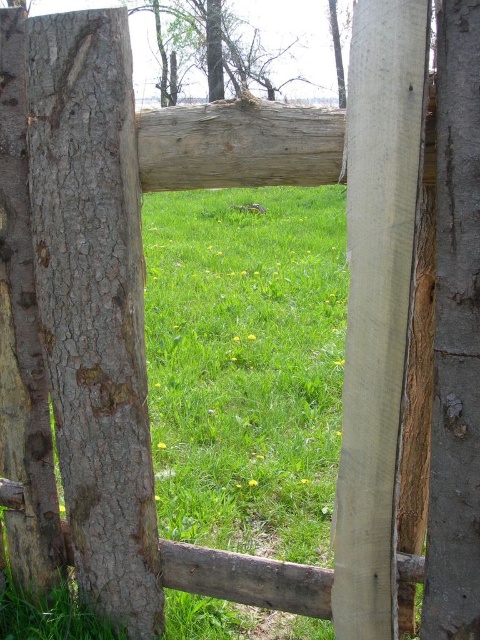
You are a painter setting up your easel to capture the rustic wooden fence and the surrounding trees. You want to highlight the contrast between the two tree trunks. Which tree trunk, the gray rough bark tree trunk at left or the smooth bark tree at upper center, would you focus on if you want to emphasize thickness?

The smooth bark tree at upper center is thicker than the gray rough bark tree trunk at left, so focusing on the smooth bark tree at upper center would emphasize its greater thickness.